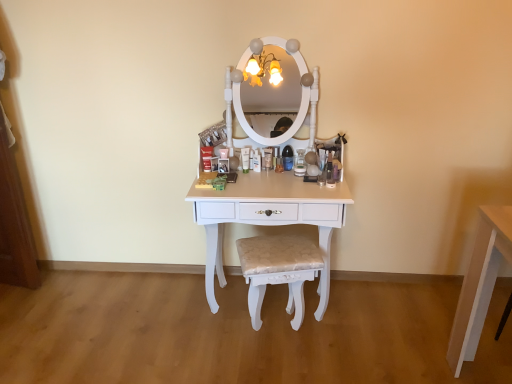
The width and height of the screenshot is (512, 384). In order to click on vacant area that lies between beige fabric cushioned stool at center and white glossy table at center in this screenshot , I will do `click(245, 335)`.